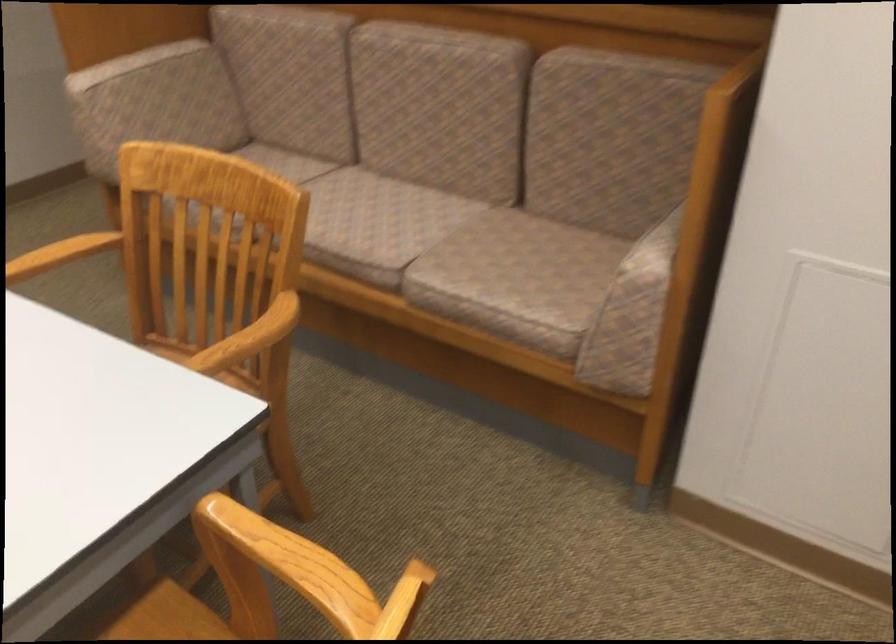
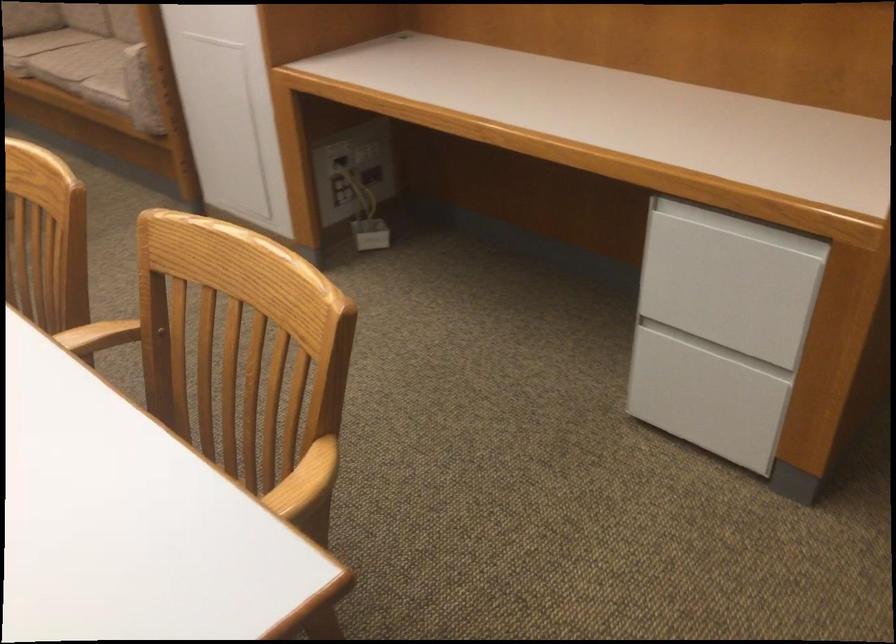
In the second image, find the point that corresponds to point (346, 232) in the first image.

(76, 61)